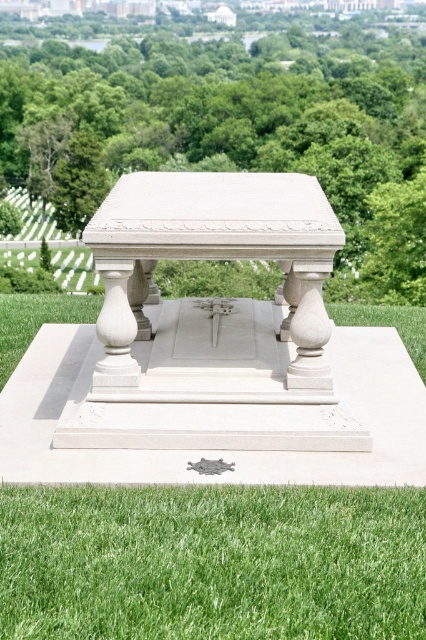
You are standing at the entrance of the monument and want to sit down. You see the white stone bench at center and the green grass at lower center. Which location is to your left?

The green grass at lower center is to the left of the white stone bench at center, so if you are facing the monument, the green grass at lower center would be on your left side.